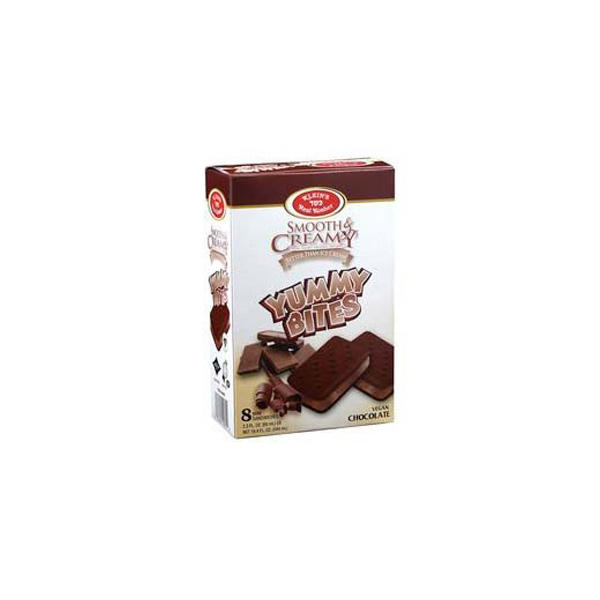
Locate an element on the screen. cardboard box is located at coordinates (x=316, y=262).